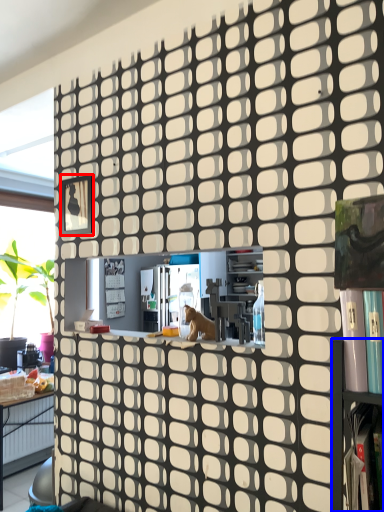
Question: Which of the following is the closest to the observer, square (highlighted by a red box) or shelf (highlighted by a blue box)?

Choices:
 (A) square
 (B) shelf

Answer: (B)